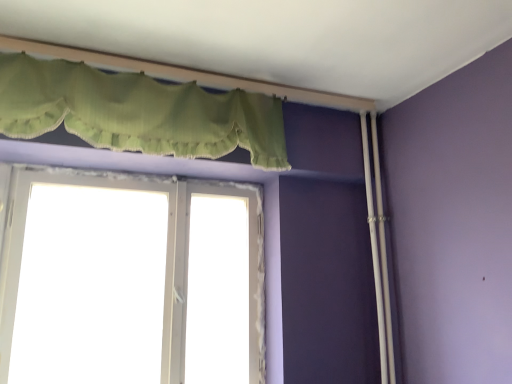
Question: Considering the positions of point (59, 69) and point (40, 362), is point (59, 69) closer or farther from the camera than point (40, 362)?

Choices:
 (A) farther
 (B) closer

Answer: (B)

Question: Considering the relative positions of green fabric valance at upper center and white plastic window at center in the image provided, is green fabric valance at upper center to the left or to the right of white plastic window at center?

Choices:
 (A) right
 (B) left

Answer: (A)

Question: In the image, is green fabric valance at upper center positioned in front of or behind white plastic window at center?

Choices:
 (A) front
 (B) behind

Answer: (A)

Question: Is white plastic window at center wider or thinner than green fabric valance at upper center?

Choices:
 (A) thin
 (B) wide

Answer: (A)

Question: Is white plastic window at center spatially inside green fabric valance at upper center, or outside of it?

Choices:
 (A) inside
 (B) outside

Answer: (B)

Question: Considering the positions of white plastic window at center and green fabric valance at upper center in the image, is white plastic window at center taller or shorter than green fabric valance at upper center?

Choices:
 (A) short
 (B) tall

Answer: (B)

Question: Considering the positions of white plastic window at center and green fabric valance at upper center in the image, is white plastic window at center bigger or smaller than green fabric valance at upper center?

Choices:
 (A) small
 (B) big

Answer: (A)